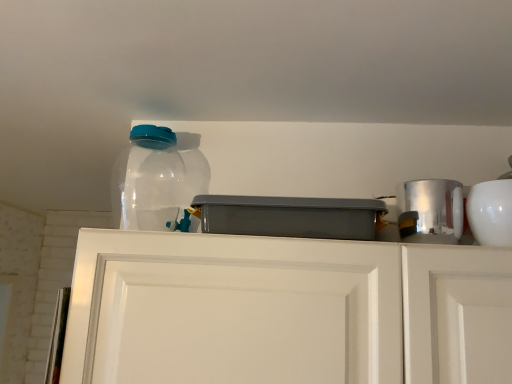
Question: Does transparent plastic bottle at upper left lie behind gray plastic container at center, placed as the 1th appliance when sorted from left to right?

Choices:
 (A) yes
 (B) no

Answer: (A)

Question: Is transparent plastic bottle at upper left to the left of gray plastic container at center, marked as the third appliance in a right-to-left arrangement, from the viewer's perspective?

Choices:
 (A) no
 (B) yes

Answer: (B)

Question: Is transparent plastic bottle at upper left thinner than gray plastic container at center, marked as the third appliance in a right-to-left arrangement?

Choices:
 (A) yes
 (B) no

Answer: (A)

Question: Is transparent plastic bottle at upper left positioned far away from gray plastic container at center, placed as the 1th appliance when sorted from left to right?

Choices:
 (A) no
 (B) yes

Answer: (A)

Question: Could you tell me if transparent plastic bottle at upper left is facing gray plastic container at center, marked as the third appliance in a right-to-left arrangement?

Choices:
 (A) no
 (B) yes

Answer: (A)

Question: Is white matte cabinet doors at center in front of or behind white glossy bowl at upper right, positioned as the 3th appliance in left-to-right order, in the image?

Choices:
 (A) front
 (B) behind

Answer: (A)

Question: Is point (499, 289) positioned closer to the camera than point (498, 193)?

Choices:
 (A) closer
 (B) farther

Answer: (A)

Question: From their relative heights in the image, would you say white matte cabinet doors at center is taller or shorter than white glossy bowl at upper right, positioned as the 3th appliance in left-to-right order?

Choices:
 (A) short
 (B) tall

Answer: (B)

Question: Considering the positions of white matte cabinet doors at center and white glossy bowl at upper right, marked as the first appliance in a right-to-left arrangement, in the image, is white matte cabinet doors at center wider or thinner than white glossy bowl at upper right, marked as the first appliance in a right-to-left arrangement,?

Choices:
 (A) wide
 (B) thin

Answer: (A)

Question: Would you say gray plastic container at center, marked as the third appliance in a right-to-left arrangement, is to the left or to the right of transparent plastic bottle at upper left in the picture?

Choices:
 (A) right
 (B) left

Answer: (A)

Question: Considering their positions, is gray plastic container at center, placed as the 1th appliance when sorted from left to right, located in front of or behind transparent plastic bottle at upper left?

Choices:
 (A) behind
 (B) front

Answer: (B)

Question: Considering the positions of gray plastic container at center, placed as the 1th appliance when sorted from left to right, and transparent plastic bottle at upper left in the image, is gray plastic container at center, placed as the 1th appliance when sorted from left to right, taller or shorter than transparent plastic bottle at upper left?

Choices:
 (A) short
 (B) tall

Answer: (A)

Question: Based on their sizes in the image, would you say gray plastic container at center, marked as the third appliance in a right-to-left arrangement, is bigger or smaller than transparent plastic bottle at upper left?

Choices:
 (A) big
 (B) small

Answer: (A)

Question: Considering the positions of gray plastic container at center, placed as the 1th appliance when sorted from left to right, and silver metallic canister at right, which is the 2th appliance from right to left, in the image, is gray plastic container at center, placed as the 1th appliance when sorted from left to right, taller or shorter than silver metallic canister at right, which is the 2th appliance from right to left,?

Choices:
 (A) tall
 (B) short

Answer: (B)

Question: Considering the positions of point (371, 226) and point (416, 215), is point (371, 226) closer or farther from the camera than point (416, 215)?

Choices:
 (A) closer
 (B) farther

Answer: (A)